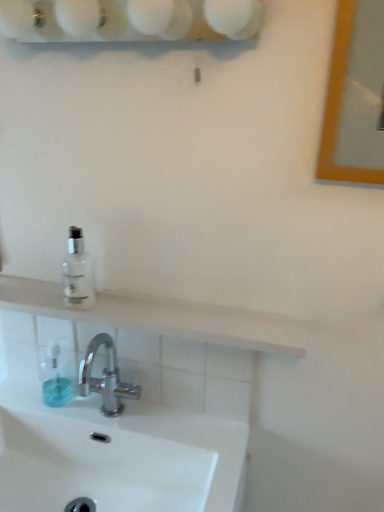
Find the location of a particular element. free area below white matte shelf at upper center (from a real-world perspective) is located at coordinates (163, 406).